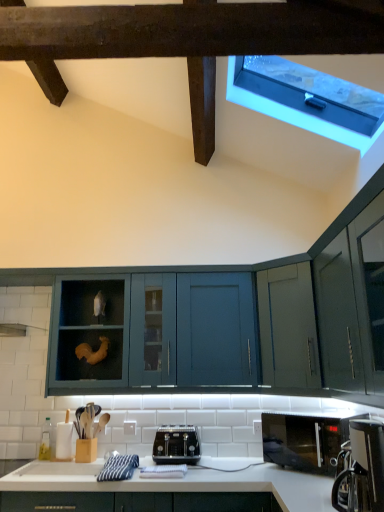
What do you see at coordinates (304, 440) in the screenshot? I see `black matte microwave at lower right` at bounding box center [304, 440].

Locate an element on the screen. The image size is (384, 512). black matte microwave at lower right is located at coordinates (304, 440).

In the scene shown: Is black plastic coffee machine at lower right next to black matte microwave at lower right and touching it?

No, black plastic coffee machine at lower right is not touching black matte microwave at lower right.

From the image's perspective, would you say black plastic coffee machine at lower right is shown under black matte microwave at lower right?

Incorrect, from the image's perspective, black plastic coffee machine at lower right is higher than black matte microwave at lower right.

Is black plastic coffee machine at lower right further to the viewer compared to black matte microwave at lower right?

No, it is in front of black matte microwave at lower right.

Which is correct: black plastic coffee machine at lower right is inside black matte microwave at lower right, or outside of it?

black plastic coffee machine at lower right lies outside black matte microwave at lower right.

The height and width of the screenshot is (512, 384). What are the coordinates of `cabinetry located above the black matte microwave at lower right (from a real-world perspective)` in the screenshot? It's located at (156, 331).

Is black matte microwave at lower right beside teal matte cabinet at center?

black matte microwave at lower right and teal matte cabinet at center are not in contact.

Between black matte microwave at lower right and teal matte cabinet at center, which one has more height?

teal matte cabinet at center.

From a real-world perspective, which object stands above the other?

teal matte cabinet at center.

Which is behind, point (185, 434) or point (295, 438)?

Point (185, 434)

Is black metallic toaster at center beside black matte microwave at lower right?

No, black metallic toaster at center is not beside black matte microwave at lower right.

Is black metallic toaster at center aimed at black matte microwave at lower right?

No, black metallic toaster at center is not oriented towards black matte microwave at lower right.

In the scene shown: Is white glossy countertop at lower center oriented towards black plastic coffee machine at lower right?

No, white glossy countertop at lower center is not aimed at black plastic coffee machine at lower right.

From the image's perspective, relative to black plastic coffee machine at lower right, is white glossy countertop at lower center above or below?

From the image's perspective, white glossy countertop at lower center appears below black plastic coffee machine at lower right.

Is white glossy countertop at lower center to the left or to the right of black plastic coffee machine at lower right in the image?

From the image, it's evident that white glossy countertop at lower center is to the left of black plastic coffee machine at lower right.

How many degrees apart are the facing directions of white glossy countertop at lower center and black plastic coffee machine at lower right?

white glossy countertop at lower center and black plastic coffee machine at lower right are facing 91.1 degrees away from each other.

Which object is more forward, black metallic toaster at center or teal matte cabinet at center?

black metallic toaster at center is closer to the camera.

Consider the image. From the image's perspective, is black metallic toaster at center above teal matte cabinet at center?

Incorrect, from the image's perspective, black metallic toaster at center is lower than teal matte cabinet at center.

Considering the points (162, 455) and (142, 341), which point is in front, point (162, 455) or point (142, 341)?

The point (162, 455) is in front.

Is teal matte cabinet at center oriented away from white glossy countertop at lower center?

teal matte cabinet at center does not have its back to white glossy countertop at lower center.

Between teal matte cabinet at center and white glossy countertop at lower center, which one is positioned in front?

white glossy countertop at lower center is in front.

Considering the relative sizes of teal matte cabinet at center and white glossy countertop at lower center in the image provided, is teal matte cabinet at center bigger than white glossy countertop at lower center?

Indeed, teal matte cabinet at center has a larger size compared to white glossy countertop at lower center.

From their relative heights in the image, would you say teal matte cabinet at center is taller or shorter than white glossy countertop at lower center?

Considering their sizes, teal matte cabinet at center has more height than white glossy countertop at lower center.

Who is bigger, white glossy countertop at lower center or transparent plastic window at upper right?

white glossy countertop at lower center.

Between white glossy countertop at lower center and transparent plastic window at upper right, which one has more height?

Standing taller between the two is transparent plastic window at upper right.

The width and height of the screenshot is (384, 512). Identify the location of countertop to the left of transparent plastic window at upper right. (177, 483).

You are a GUI agent. You are given a task and a screenshot of the screen. Output one action in this format:
    pyautogui.click(x=<x>, y=<y>)
    Task: Click on the coffee machine above the black matte microwave at lower right (from a real-world perspective)
    The height and width of the screenshot is (512, 384).
    Given the screenshot: What is the action you would take?
    pyautogui.click(x=363, y=469)

Image resolution: width=384 pixels, height=512 pixels. Find the location of `cabinetry behind the black matte microwave at lower right`. cabinetry behind the black matte microwave at lower right is located at coordinates (156, 331).

Which object lies nearer to the anchor point teal matte cabinet at center, white glossy countertop at lower center or black metallic toaster at center?

Based on the image, black metallic toaster at center appears to be nearer to teal matte cabinet at center.

Which object lies further to the anchor point black metallic toaster at center, teal matte cabinet at center or black matte microwave at lower right?

Based on the image, teal matte cabinet at center appears to be further to black metallic toaster at center.

When comparing their distances from black plastic coffee machine at lower right, does white glossy countertop at lower center or black metallic toaster at center seem closer?

Based on the image, white glossy countertop at lower center appears to be nearer to black plastic coffee machine at lower right.

When comparing their distances from black metallic toaster at center, does black matte microwave at lower right or transparent plastic window at upper right seem closer?

black matte microwave at lower right lies closer to black metallic toaster at center than the other object.

When comparing their distances from teal matte cabinet at center, does transparent plastic window at upper right or white glossy countertop at lower center seem further?

transparent plastic window at upper right is further to teal matte cabinet at center.

Based on their spatial positions, is white glossy countertop at lower center or black matte microwave at lower right further from black plastic coffee machine at lower right?

black matte microwave at lower right is positioned further to the anchor black plastic coffee machine at lower right.

In the scene shown: When comparing their distances from black plastic coffee machine at lower right, does black metallic toaster at center or teal matte cabinet at center seem further?

Among the two, teal matte cabinet at center is located further to black plastic coffee machine at lower right.

From the image, which object appears to be farther from transparent plastic window at upper right, teal matte cabinet at center or white glossy countertop at lower center?

white glossy countertop at lower center lies further to transparent plastic window at upper right than the other object.

The height and width of the screenshot is (512, 384). What are the coordinates of `microwave oven located between black plastic coffee machine at lower right and black metallic toaster at center in the depth direction` in the screenshot? It's located at (304, 440).

Image resolution: width=384 pixels, height=512 pixels. Find the location of `cabinetry between transparent plastic window at upper right and black matte microwave at lower right from top to bottom`. cabinetry between transparent plastic window at upper right and black matte microwave at lower right from top to bottom is located at coordinates (156, 331).

At what (x,y) coordinates should I click in order to perform the action: click on cabinetry between transparent plastic window at upper right and black metallic toaster at center in the vertical direction. Please return your answer as a coordinate pair (x, y). Looking at the image, I should click on (156, 331).

Identify the location of microwave oven between transparent plastic window at upper right and black metallic toaster at center from top to bottom. (304, 440).